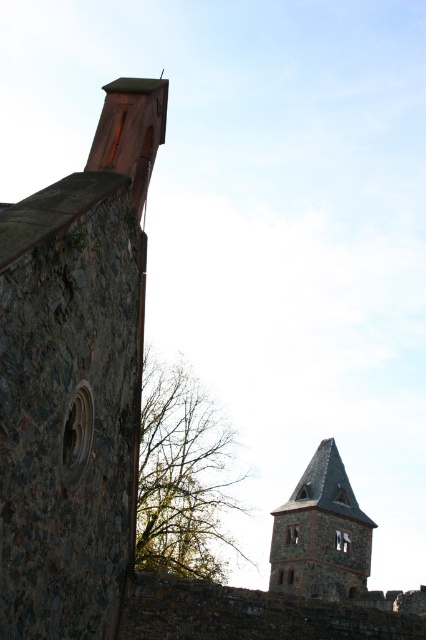
Question: In this image, where is rustic stone tower at upper right located relative to gray stone tower at center?

Choices:
 (A) below
 (B) above

Answer: (B)

Question: Does rustic stone tower at upper right appear over gray stone tower at center?

Choices:
 (A) yes
 (B) no

Answer: (A)

Question: Which point is farther to the camera?

Choices:
 (A) gray stone tower at center
 (B) rustic stone tower at upper right

Answer: (A)

Question: Is rustic stone tower at upper right above gray stone tower at center?

Choices:
 (A) no
 (B) yes

Answer: (B)